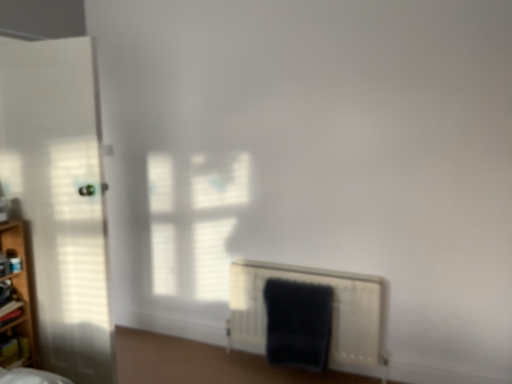
Question: Considering the positions of wooden shelf at left and dark blue plush bath towel at lower right in the image, is wooden shelf at left wider or thinner than dark blue plush bath towel at lower right?

Choices:
 (A) thin
 (B) wide

Answer: (B)

Question: Is point (13, 231) positioned closer to the camera than point (271, 359)?

Choices:
 (A) farther
 (B) closer

Answer: (B)

Question: Which object is positioned closest to the dark blue plush bath towel at lower right?

Choices:
 (A) wooden shelf at left
 (B) white matte radiator at lower center
 (C) white matte door at left

Answer: (B)

Question: Estimate the real-world distances between objects in this image. Which object is farther from the white matte radiator at lower center?

Choices:
 (A) wooden shelf at left
 (B) dark blue plush bath towel at lower right
 (C) white matte door at left

Answer: (A)